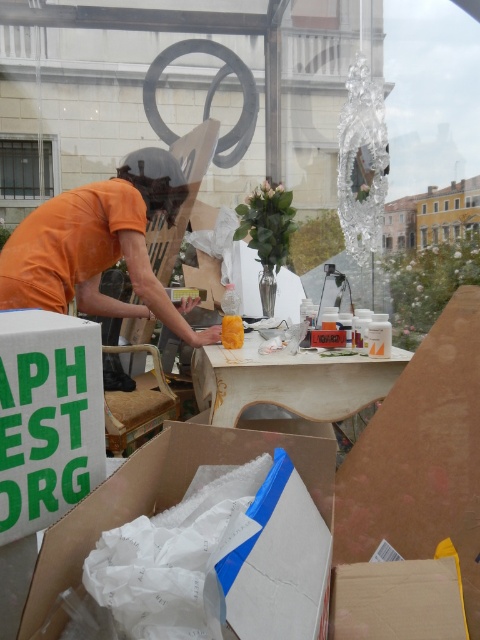
Question: Can you confirm if orange cotton shirt at left is positioned to the right of white foam at lower left?

Choices:
 (A) yes
 (B) no

Answer: (B)

Question: Which object is positioned closest to the wooden table at center?

Choices:
 (A) orange cotton shirt at left
 (B) yellow matte sponge at center
 (C) white foam at lower left

Answer: (B)

Question: Does orange cotton shirt at left lie in front of yellow matte sponge at center?

Choices:
 (A) yes
 (B) no

Answer: (A)

Question: Which of the following is the closest to the observer?

Choices:
 (A) coord(370,388)
 (B) coord(232,317)
 (C) coord(123,216)
 (D) coord(163,460)

Answer: (D)

Question: Is white foam at lower left behind yellow matte sponge at center?

Choices:
 (A) no
 (B) yes

Answer: (A)

Question: Which point is closer to the camera taking this photo?

Choices:
 (A) (120, 483)
 (B) (127, 388)
 (C) (228, 340)

Answer: (A)